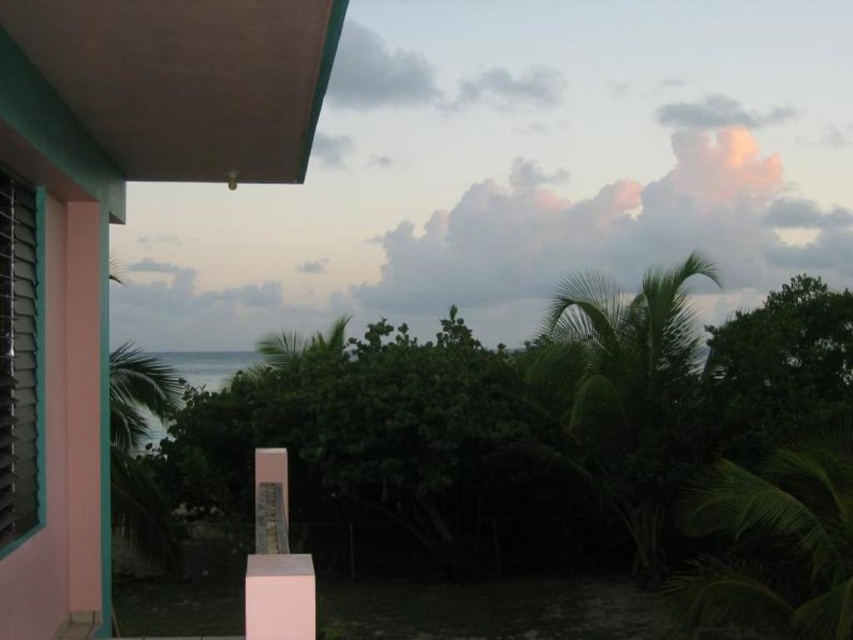
Is green leafy palm tree at right to the left of green leafy palm tree at center from the viewer's perspective?

Correct, you'll find green leafy palm tree at right to the left of green leafy palm tree at center.

Find the location of `green leafy palm tree at right`. green leafy palm tree at right is located at coordinates (622, 385).

Who is more distant from viewer, (582, 429) or (766, 568)?

The point (582, 429) is behind.

Where is `green leafy palm tree at right`? This screenshot has height=640, width=853. green leafy palm tree at right is located at coordinates (622, 385).

Can you confirm if pink concrete balcony at upper left is thinner than green leafy palm tree at right?

Yes, pink concrete balcony at upper left is thinner than green leafy palm tree at right.

Is point (64, 342) closer to viewer compared to point (607, 440)?

Yes, point (64, 342) is in front of point (607, 440).

The image size is (853, 640). What do you see at coordinates (107, 232) in the screenshot?
I see `pink concrete balcony at upper left` at bounding box center [107, 232].

I want to click on pink concrete balcony at upper left, so click(x=107, y=232).

Is pink concrete balcony at upper left taller than green leafy palm tree at center?

Correct, pink concrete balcony at upper left is much taller as green leafy palm tree at center.

This screenshot has height=640, width=853. What are the coordinates of `pink concrete balcony at upper left` in the screenshot? It's located at (107, 232).

Image resolution: width=853 pixels, height=640 pixels. What do you see at coordinates (107, 232) in the screenshot? I see `pink concrete balcony at upper left` at bounding box center [107, 232].

Identify the location of pink concrete balcony at upper left. Image resolution: width=853 pixels, height=640 pixels. (107, 232).